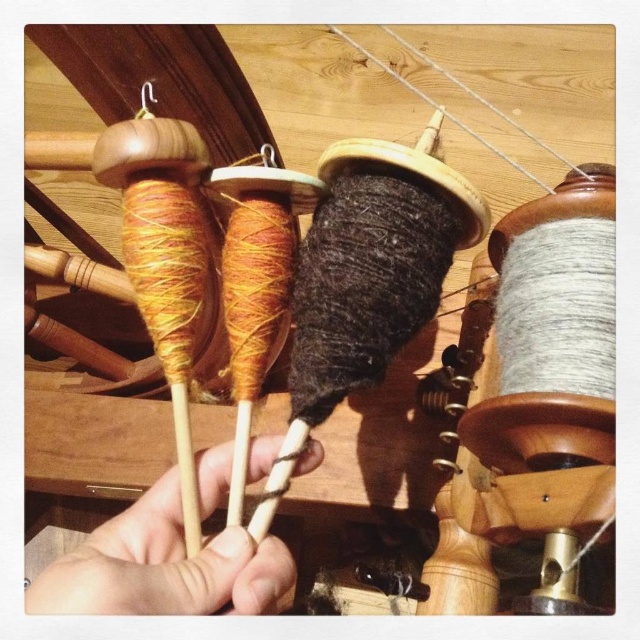
Question: Among these points, which one is nearest to the camera?

Choices:
 (A) (340, 230)
 (B) (164, 589)

Answer: (B)

Question: Does dark woolen yarn at center appear on the left side of wooden chopsticks at center?

Choices:
 (A) no
 (B) yes

Answer: (A)

Question: Does wooden chopsticks at center have a smaller size compared to matte wood spindles at left?

Choices:
 (A) yes
 (B) no

Answer: (A)

Question: Which object is closer to the camera taking this photo?

Choices:
 (A) dark woolen yarn at center
 (B) wooden chopsticks at center
 (C) matte wood spindles at left

Answer: (B)

Question: Does wooden chopsticks at center appear on the left side of matte wood spindles at left?

Choices:
 (A) no
 (B) yes

Answer: (A)

Question: Which point appears closest to the camera in this image?

Choices:
 (A) (227, 74)
 (B) (452, 244)
 (C) (131, 561)

Answer: (C)